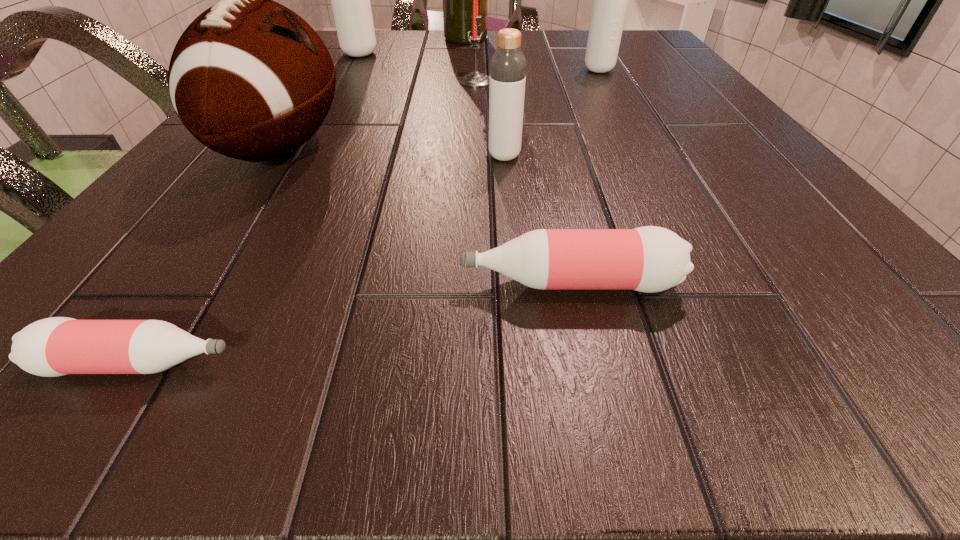
Locate an element on the screen. This screenshot has width=960, height=540. empty space that is in between the farther pink bottle and the farthest object is located at coordinates pos(517,161).

This screenshot has width=960, height=540. I want to click on vacant space that is in between the football (American) and the red candle, so click(x=378, y=114).

Locate an element on the screen. This screenshot has width=960, height=540. vacant area between the wine bottle and the football (American) is located at coordinates (373, 93).

The height and width of the screenshot is (540, 960). Find the location of `free space between the tallest object and the football (American)`. free space between the tallest object and the football (American) is located at coordinates (373, 93).

The height and width of the screenshot is (540, 960). Identify the location of vacant area that lies between the right pink bottle and the third farthest bottle. (537, 220).

Where is `free area in between the tallest bottle and the fourth farthest bottle`? Image resolution: width=960 pixels, height=540 pixels. free area in between the tallest bottle and the fourth farthest bottle is located at coordinates (465, 168).

Locate which object ranks fourth in proximity to the candle. Please provide its 2D coordinates. Your answer should be formatted as a tuple, i.e. [(x, y)], where the tuple contains the x and y coordinates of a point satisfying the conditions above.

[(507, 79)]

Point out which object is positioned as the sixth nearest to the second shortest object. Please provide its 2D coordinates. Your answer should be formatted as a tuple, i.e. [(x, y)], where the tuple contains the x and y coordinates of a point satisfying the conditions above.

[(350, 0)]

Identify which bottle is the closest to the fourth shortest bottle. Please provide its 2D coordinates. Your answer should be formatted as a tuple, i.e. [(x, y)], where the tuple contains the x and y coordinates of a point satisfying the conditions above.

[(507, 79)]

What are the coordinates of `the closest bottle to the football (American)` in the screenshot? It's located at (649, 259).